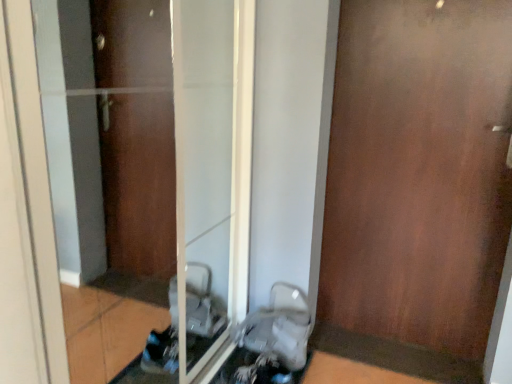
Question: Is brown wood door at right beside transparent glass door at center?

Choices:
 (A) yes
 (B) no

Answer: (B)

Question: Is brown wood door at right turned away from transparent glass door at center?

Choices:
 (A) no
 (B) yes

Answer: (A)

Question: From a real-world perspective, is brown wood door at right located beneath transparent glass door at center?

Choices:
 (A) yes
 (B) no

Answer: (B)

Question: Is brown wood door at right aimed at transparent glass door at center?

Choices:
 (A) no
 (B) yes

Answer: (A)

Question: Is brown wood door at right to the left of transparent glass door at center from the viewer's perspective?

Choices:
 (A) yes
 (B) no

Answer: (B)

Question: From the image's perspective, would you say brown wood door at right is positioned over transparent glass door at center?

Choices:
 (A) yes
 (B) no

Answer: (A)

Question: Does white plastic baby carriage at lower center have a greater width compared to brown wood door at right?

Choices:
 (A) yes
 (B) no

Answer: (A)

Question: Is the depth of white plastic baby carriage at lower center less than that of brown wood door at right?

Choices:
 (A) no
 (B) yes

Answer: (A)

Question: Is white plastic baby carriage at lower center shorter than brown wood door at right?

Choices:
 (A) no
 (B) yes

Answer: (B)

Question: From a real-world perspective, is white plastic baby carriage at lower center physically below brown wood door at right?

Choices:
 (A) yes
 (B) no

Answer: (A)

Question: From the image's perspective, is white plastic baby carriage at lower center under brown wood door at right?

Choices:
 (A) no
 (B) yes

Answer: (B)

Question: From the image's perspective, is white plastic baby carriage at lower center on brown wood door at right?

Choices:
 (A) yes
 (B) no

Answer: (B)

Question: Is transparent glass door at center outside white plastic baby carriage at lower center?

Choices:
 (A) yes
 (B) no

Answer: (A)